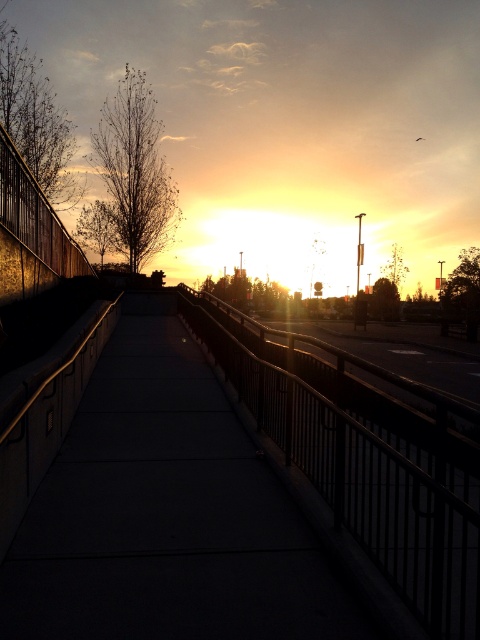
Question: Which of the following is the closest to the observer?

Choices:
 (A) metallic rail at center
 (B) concrete sidewalk at center

Answer: (B)

Question: Is concrete sidewalk at center to the right of metallic rail at center from the viewer's perspective?

Choices:
 (A) no
 (B) yes

Answer: (A)

Question: Is concrete sidewalk at center behind metallic rail at center?

Choices:
 (A) yes
 (B) no

Answer: (B)

Question: Does concrete sidewalk at center have a smaller size compared to metallic rail at center?

Choices:
 (A) no
 (B) yes

Answer: (A)

Question: Which of the following is the closest to the observer?

Choices:
 (A) (191, 609)
 (B) (326, 468)

Answer: (A)